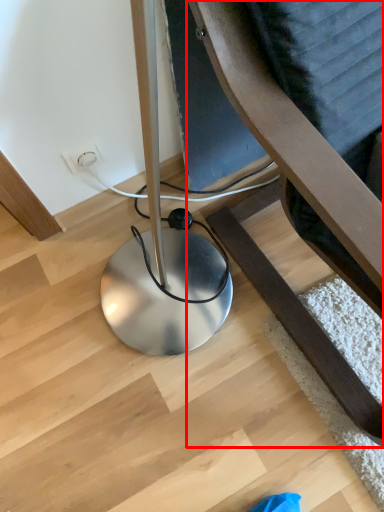
Question: From the image's perspective, where is furniture (annotated by the red box) located in relation to electric outlet in the image?

Choices:
 (A) below
 (B) above

Answer: (A)